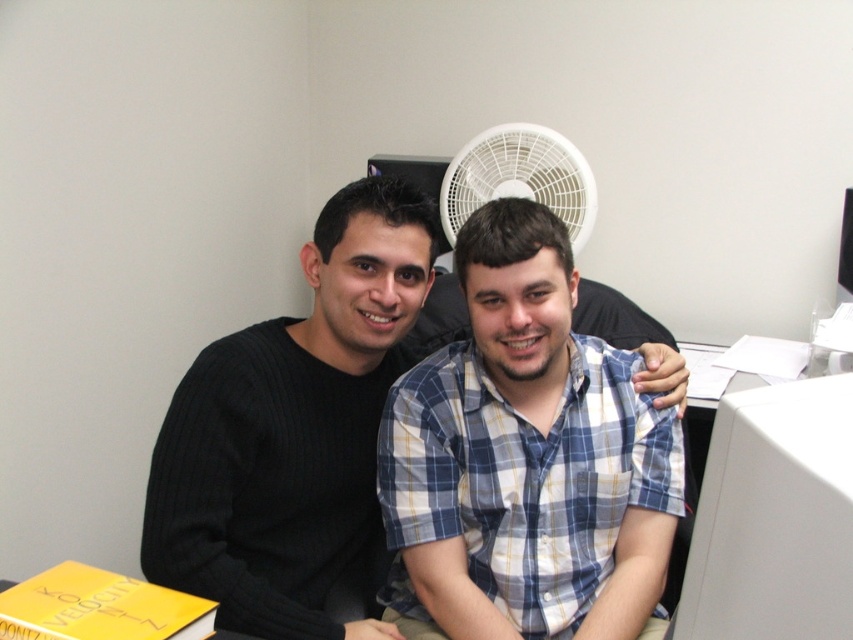
Question: Which object is the farthest from the blue plaid shirt at center?

Choices:
 (A) white plastic fan at upper center
 (B) black ribbed sweater at left

Answer: (A)

Question: Does blue plaid shirt at center appear over black ribbed sweater at left?

Choices:
 (A) no
 (B) yes

Answer: (A)

Question: Which point appears farthest from the camera in this image?

Choices:
 (A) (801, 508)
 (B) (592, 224)

Answer: (B)

Question: Estimate the real-world distances between objects in this image. Which object is farther from the white plastic fan at upper center?

Choices:
 (A) black ribbed sweater at left
 (B) white plastic monitor at right

Answer: (B)

Question: In this image, where is black ribbed sweater at left located relative to white plastic fan at upper center?

Choices:
 (A) above
 (B) below

Answer: (B)

Question: Does white plastic monitor at right have a smaller size compared to white plastic fan at upper center?

Choices:
 (A) no
 (B) yes

Answer: (B)